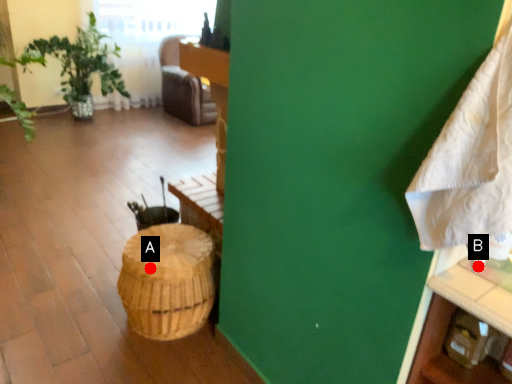
Question: Two points are circled on the image, labeled by A and B beside each circle. Among these points, which one is nearest to the camera?

Choices:
 (A) A is closer
 (B) B is closer

Answer: (B)